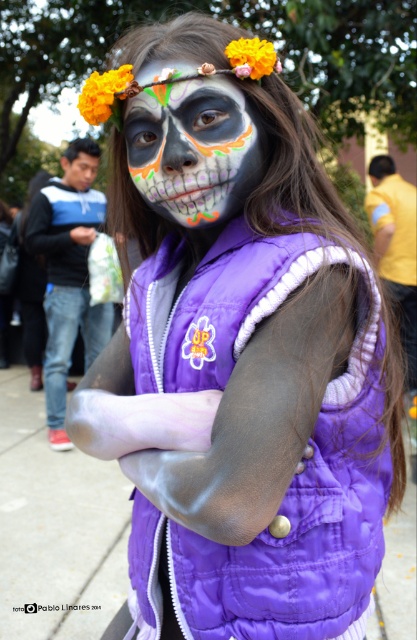
Based on the photo, you are a photographer at the event and want to capture a closeup of the person. Which object, the matte black face paint at center or the orange matte flower at upper left, is positioned lower in the image?

A: The matte black face paint at center is located below the orange matte flower at upper left, so it is positioned lower in the image.

You are a photographer trying to capture the perfect shot of the person in the scene. If you want to focus on the matte black face paint at center, what coordinates should you aim your camera at?

The matte black face paint at center is located at coordinates point (190, 145), so you should aim your camera at those coordinates to focus on it.

You are a photographer trying to capture the details of the matte black face paint at center and the orange matte flower at upper center. If your camera has a zoom lens that can focus on objects within a 10 cm diameter, will you be able to clearly capture both elements in a single focused shot?

The matte black face paint at center and orange matte flower at upper center are 12.93 centimeters apart from each other. Since the distance between them exceeds the 10 cm diameter focus range of the camera lens, you will not be able to capture both elements in a single focused shot clearly.